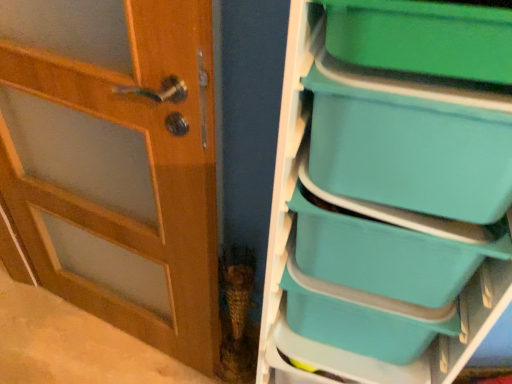
This screenshot has height=384, width=512. I want to click on teal plastic storage box at right, marked as the first storage box in a bottom-to-top arrangement, so click(x=362, y=318).

This screenshot has height=384, width=512. Identify the location of teal plastic storage box at upper right, placed as the third storage box when sorted from bottom to top. (412, 141).

Is wooden door at left bigger than teal plastic storage bins at right?

No.

Which of these two, wooden door at left or teal plastic storage bins at right, is wider?

Wider between the two is teal plastic storage bins at right.

From the image's perspective, is wooden door at left beneath teal plastic storage bins at right?

Incorrect, from the image's perspective, wooden door at left is higher than teal plastic storage bins at right.

Between green plastic storage box at upper right, the first storage box in the top-to-bottom sequence, and teal plastic storage box at right, which ranks as the second storage box in bottom-to-top order, which one appears on the left side from the viewer's perspective?

From the viewer's perspective, green plastic storage box at upper right, the first storage box in the top-to-bottom sequence, appears more on the left side.

There is a green plastic storage box at upper right, the first storage box in the top-to-bottom sequence. Where is `the 2nd storage box below it (from a real-world perspective)`? The width and height of the screenshot is (512, 384). the 2nd storage box below it (from a real-world perspective) is located at coordinates (387, 255).

Based on the photo, are teal plastic storage box at right, which ranks as the second storage box in bottom-to-top order, and teal plastic storage box at upper right, placed as the third storage box when sorted from bottom to top, far apart?

teal plastic storage box at right, which ranks as the second storage box in bottom-to-top order, is near teal plastic storage box at upper right, placed as the third storage box when sorted from bottom to top, not far away.

Between teal plastic storage box at right, which ranks as the second storage box in bottom-to-top order, and teal plastic storage box at upper right, arranged as the 2th storage box when viewed from the top, which one appears on the left side from the viewer's perspective?

teal plastic storage box at right, which ranks as the second storage box in bottom-to-top order, is more to the left.

Based on the photo, does teal plastic storage box at right, which ranks as the second storage box in bottom-to-top order, have a smaller size compared to teal plastic storage box at upper right, placed as the third storage box when sorted from bottom to top?

Yes.

Considering the sizes of teal plastic storage bins at right and teal plastic storage box at upper right, arranged as the 2th storage box when viewed from the top, in the image, is teal plastic storage bins at right wider or thinner than teal plastic storage box at upper right, arranged as the 2th storage box when viewed from the top,?

In the image, teal plastic storage bins at right appears to be wider than teal plastic storage box at upper right, arranged as the 2th storage box when viewed from the top.

From a real-world perspective, which is physically below, teal plastic storage bins at right or teal plastic storage box at upper right, arranged as the 2th storage box when viewed from the top?

From a 3D spatial view, teal plastic storage bins at right is below.

Is teal plastic storage box at upper right, arranged as the 2th storage box when viewed from the top, at the back of teal plastic storage bins at right?

Yes, teal plastic storage bins at right is facing away from teal plastic storage box at upper right, arranged as the 2th storage box when viewed from the top.

Looking at this image, would you say teal plastic storage bins at right is a long distance from teal plastic storage box at upper right, placed as the third storage box when sorted from bottom to top?

They are positioned close to each other.

How many degrees apart are the facing directions of teal plastic storage box at right, marked as the first storage box in a bottom-to-top arrangement, and wooden door at left?

The facing directions of teal plastic storage box at right, marked as the first storage box in a bottom-to-top arrangement, and wooden door at left are 25.3 degrees apart.

Is wooden door at left at the back of teal plastic storage box at right, which ranks as the 4th storage box in top-to-bottom order?

That's not correct — teal plastic storage box at right, which ranks as the 4th storage box in top-to-bottom order, is not looking away from wooden door at left.

Which is more to the left, teal plastic storage box at right, which ranks as the 4th storage box in top-to-bottom order, or wooden door at left?

From the viewer's perspective, wooden door at left appears more on the left side.

Considering the relative sizes of teal plastic storage box at right, marked as the first storage box in a bottom-to-top arrangement, and wooden door at left in the image provided, is teal plastic storage box at right, marked as the first storage box in a bottom-to-top arrangement, shorter than wooden door at left?

Yes, teal plastic storage box at right, marked as the first storage box in a bottom-to-top arrangement, is shorter than wooden door at left.

Consider the image. Can you confirm if green plastic storage box at upper right, the first storage box in the top-to-bottom sequence, is positioned to the left of wooden door at left?

No.

What's the angular difference between green plastic storage box at upper right, the first storage box in the top-to-bottom sequence, and wooden door at left's facing directions?

25.4 degrees.

Considering the relative sizes of green plastic storage box at upper right, the first storage box in the top-to-bottom sequence, and wooden door at left in the image provided, is green plastic storage box at upper right, the first storage box in the top-to-bottom sequence, wider than wooden door at left?

Indeed, green plastic storage box at upper right, the first storage box in the top-to-bottom sequence, has a greater width compared to wooden door at left.

From the picture: From their relative heights in the image, would you say green plastic storage box at upper right, the first storage box in the top-to-bottom sequence, is taller or shorter than wooden door at left?

Considering their sizes, green plastic storage box at upper right, the first storage box in the top-to-bottom sequence, has less height than wooden door at left.

From a real-world perspective, who is located higher, teal plastic storage box at right, which ranks as the 4th storage box in top-to-bottom order, or teal plastic storage box at upper right, arranged as the 2th storage box when viewed from the top?

teal plastic storage box at upper right, arranged as the 2th storage box when viewed from the top, from a real-world perspective.

Could you measure the distance between teal plastic storage box at right, which ranks as the 4th storage box in top-to-bottom order, and teal plastic storage box at upper right, arranged as the 2th storage box when viewed from the top?

A distance of 15.24 inches exists between teal plastic storage box at right, which ranks as the 4th storage box in top-to-bottom order, and teal plastic storage box at upper right, arranged as the 2th storage box when viewed from the top.

In the image, is teal plastic storage box at right, which ranks as the 4th storage box in top-to-bottom order, on the left side or the right side of teal plastic storage box at upper right, arranged as the 2th storage box when viewed from the top?

teal plastic storage box at right, which ranks as the 4th storage box in top-to-bottom order, is positioned on teal plastic storage box at upper right, arranged as the 2th storage box when viewed from the top,'s left side.

Considering the relative sizes of teal plastic storage box at right, which ranks as the 4th storage box in top-to-bottom order, and teal plastic storage box at upper right, placed as the third storage box when sorted from bottom to top, in the image provided, is teal plastic storage box at right, which ranks as the 4th storage box in top-to-bottom order, wider than teal plastic storage box at upper right, placed as the third storage box when sorted from bottom to top,?

In fact, teal plastic storage box at right, which ranks as the 4th storage box in top-to-bottom order, might be narrower than teal plastic storage box at upper right, placed as the third storage box when sorted from bottom to top.

This screenshot has width=512, height=384. I want to click on shelf below the wooden door at left (from the image's perspective), so click(x=389, y=192).

Which storage box is the 2nd one when counting from the right side of the green plastic storage box at upper right, the first storage box in the top-to-bottom sequence? Please provide its 2D coordinates.

[(387, 255)]

Considering their positions, is green plastic storage box at upper right, the 4th storage box positioned from the bottom, positioned closer to teal plastic storage box at upper right, arranged as the 2th storage box when viewed from the top, than teal plastic storage bins at right?

teal plastic storage bins at right is closer to teal plastic storage box at upper right, arranged as the 2th storage box when viewed from the top.

Looking at the image, which one is located further to teal plastic storage box at right, marked as the first storage box in a bottom-to-top arrangement, teal plastic storage box at upper right, arranged as the 2th storage box when viewed from the top, or green plastic storage box at upper right, the 4th storage box positioned from the bottom?

green plastic storage box at upper right, the 4th storage box positioned from the bottom, lies further to teal plastic storage box at right, marked as the first storage box in a bottom-to-top arrangement, than the other object.

From the image, which object appears to be farther from teal plastic storage bins at right, wooden door at left or green plastic storage box at upper right, the first storage box in the top-to-bottom sequence?

wooden door at left is positioned further to the anchor teal plastic storage bins at right.

Based on the photo, based on their spatial positions, is teal plastic storage bins at right or teal plastic storage box at right, marked as the first storage box in a bottom-to-top arrangement, closer to wooden door at left?

teal plastic storage bins at right.

Which object lies further to the anchor point teal plastic storage box at right, which ranks as the 4th storage box in top-to-bottom order, wooden door at left or teal plastic storage box at upper right, arranged as the 2th storage box when viewed from the top?

Among the two, wooden door at left is located further to teal plastic storage box at right, which ranks as the 4th storage box in top-to-bottom order.

From the image, which object appears to be farther from teal plastic storage bins at right, wooden door at left or teal plastic storage box at right, which ranks as the 4th storage box in top-to-bottom order?

wooden door at left is positioned further to the anchor teal plastic storage bins at right.

Estimate the real-world distances between objects in this image. Which object is further from teal plastic storage bins at right, teal plastic storage box at right, which ranks as the second storage box in bottom-to-top order, or green plastic storage box at upper right, the first storage box in the top-to-bottom sequence?

green plastic storage box at upper right, the first storage box in the top-to-bottom sequence, lies further to teal plastic storage bins at right than the other object.

Which object lies nearer to the anchor point teal plastic storage box at right, marked as the first storage box in a bottom-to-top arrangement, teal plastic storage bins at right or teal plastic storage box at upper right, placed as the third storage box when sorted from bottom to top?

The object closer to teal plastic storage box at right, marked as the first storage box in a bottom-to-top arrangement, is teal plastic storage bins at right.

Identify the location of shelf between wooden door at left and teal plastic storage box at upper right, placed as the third storage box when sorted from bottom to top. (389, 192).

Identify the location of storage box that lies between teal plastic storage box at upper right, arranged as the 2th storage box when viewed from the top, and teal plastic storage box at right, which ranks as the 4th storage box in top-to-bottom order, from top to bottom. (387, 255).

The height and width of the screenshot is (384, 512). Identify the location of storage box between green plastic storage box at upper right, the first storage box in the top-to-bottom sequence, and teal plastic storage box at right, which ranks as the 3th storage box in top-to-bottom order, in the up-down direction. (412, 141).

Locate an element on the screen. This screenshot has width=512, height=384. shelf situated between wooden door at left and teal plastic storage box at right, which ranks as the second storage box in bottom-to-top order, from left to right is located at coordinates (389, 192).